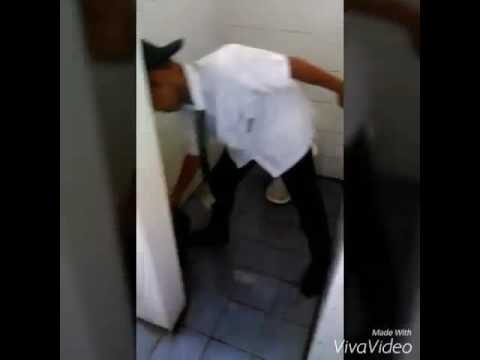
At what (x,y) coordinates should I click in order to perform the action: click on toilet. Please return your answer as a coordinate pair (x, y). Looking at the image, I should click on 317,150.